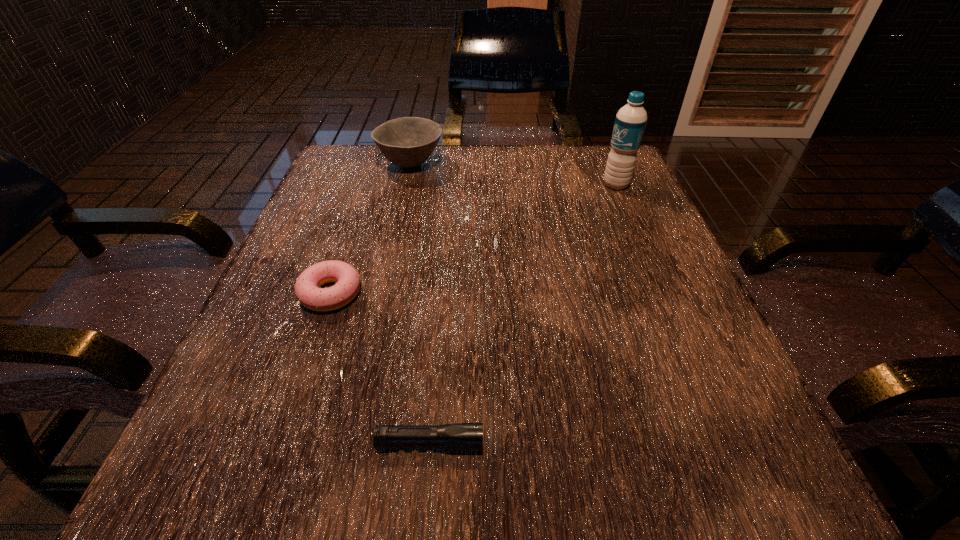
At what (x,y) coordinates should I click in order to perform the action: click on vacant space located on the right of the bowl. Please return your answer as a coordinate pair (x, y). Looking at the image, I should click on (534, 163).

The height and width of the screenshot is (540, 960). I want to click on free spot located 0.290m on the right of the doughnut, so click(533, 293).

You are a GUI agent. You are given a task and a screenshot of the screen. Output one action in this format:
    pyautogui.click(x=<x>, y=<y>)
    Task: Click on the vacant space located at the lens end of the shortest object
    This screenshot has height=540, width=960.
    Given the screenshot: What is the action you would take?
    pyautogui.click(x=634, y=443)

This screenshot has width=960, height=540. What are the coordinates of `water bottle that is at the far edge` in the screenshot? It's located at (630, 122).

Identify the location of bowl that is positioned at the far edge. Image resolution: width=960 pixels, height=540 pixels. (407, 142).

At what (x,y) coordinates should I click in order to perform the action: click on object positioned at the near edge. Please return your answer as a coordinate pair (x, y). The width and height of the screenshot is (960, 540). Looking at the image, I should click on (460, 436).

Locate an element on the screen. This screenshot has width=960, height=540. bowl that is at the left edge is located at coordinates (407, 142).

You are a GUI agent. You are given a task and a screenshot of the screen. Output one action in this format:
    pyautogui.click(x=<x>, y=<y>)
    Task: Click on the doughnut that is at the left edge
    The height and width of the screenshot is (540, 960).
    Given the screenshot: What is the action you would take?
    pyautogui.click(x=307, y=291)

Identify the location of object located in the right edge section of the desktop. (630, 122).

You are a GUI agent. You are given a task and a screenshot of the screen. Output one action in this format:
    pyautogui.click(x=<x>, y=<y>)
    Task: Click on the object that is at the far left corner
    Image resolution: width=960 pixels, height=540 pixels.
    Given the screenshot: What is the action you would take?
    pyautogui.click(x=407, y=142)